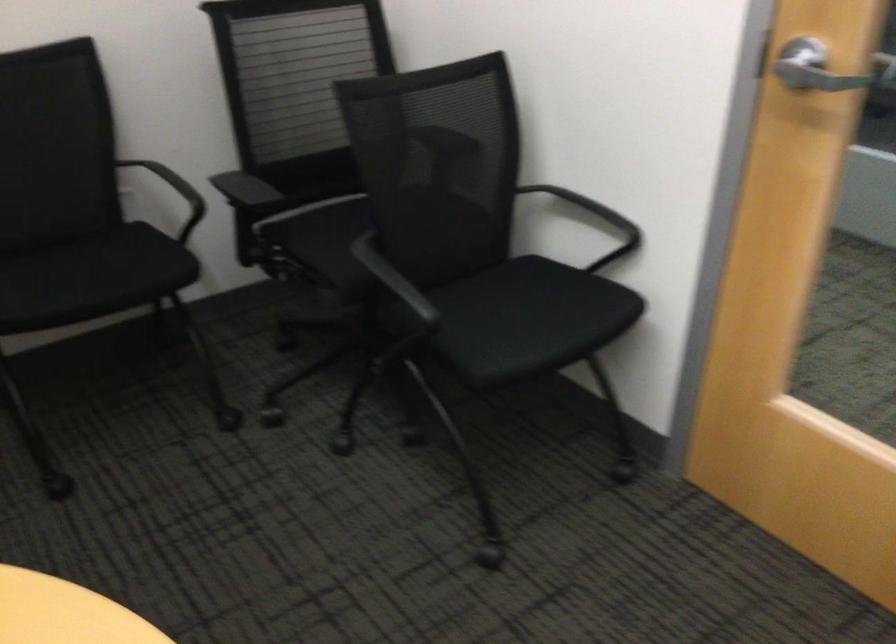
Find where to pull the silver door handle. Please return your answer as a coordinate pair (x, y).

(826, 69)